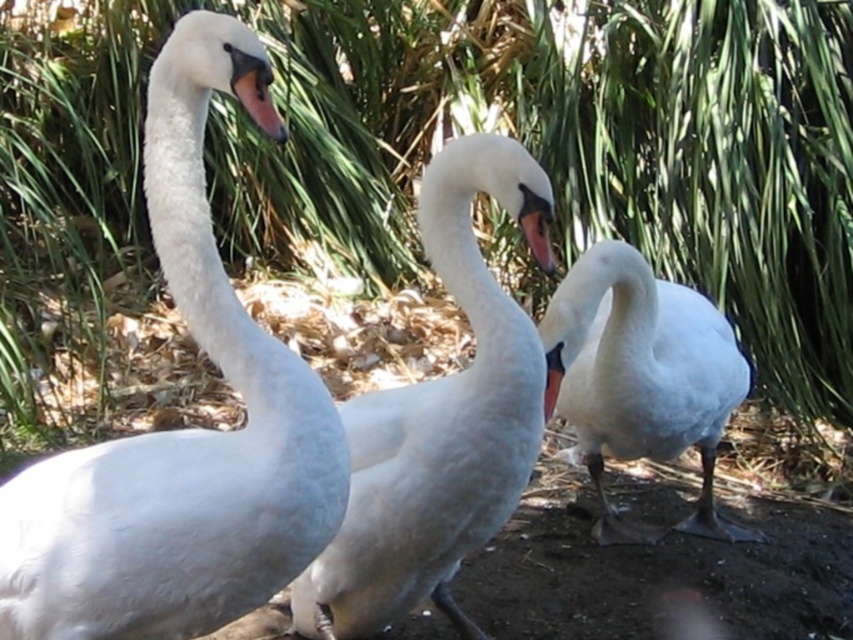
Is point (544, 266) farther from viewer compared to point (552, 388)?

No, it is in front of (552, 388).

Does pink glossy beak at center appear on the right side of matte orange beak at center?

In fact, pink glossy beak at center is to the left of matte orange beak at center.

Between point (532, 218) and point (548, 369), which one is positioned in front?

Point (532, 218) is in front.

In order to click on pink glossy beak at center in this screenshot , I will do point(538,236).

Is point (711, 492) farther from viewer compared to point (549, 355)?

Yes, it is behind point (549, 355).

Between white matte swan at center and matte orange beak at center, which one has more height?

With more height is white matte swan at center.

The width and height of the screenshot is (853, 640). Identify the location of white matte swan at center. (643, 378).

Which is more to the left, white matte swan at left or matte orange beak at center?

white matte swan at left

Does white matte swan at left have a greater width compared to matte orange beak at center?

Correct, the width of white matte swan at left exceeds that of matte orange beak at center.

Does point (267, 358) lie behind point (553, 365)?

No, it is not.

Locate an element on the screen. white matte swan at left is located at coordinates (180, 429).